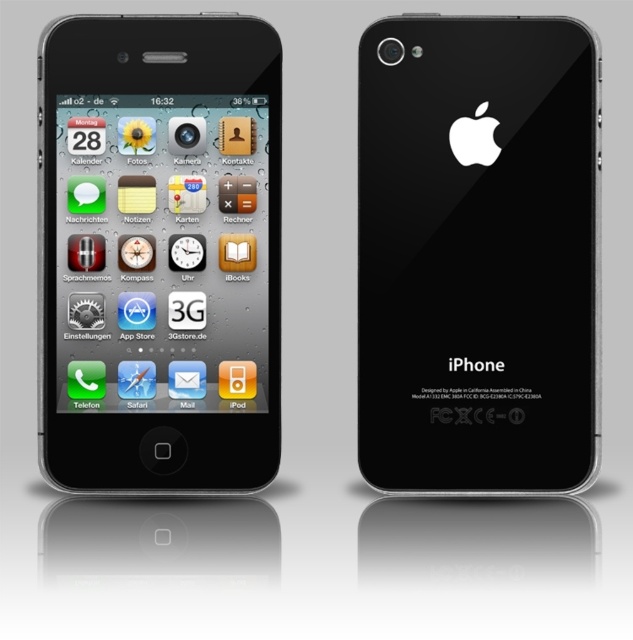
Question: Which point is farther from the camera taking this photo?

Choices:
 (A) (503, 250)
 (B) (70, 28)

Answer: (A)

Question: From the image, what is the correct spatial relationship of black glossy iphone at left in relation to black glossy iphone at center?

Choices:
 (A) above
 (B) below

Answer: (A)

Question: Which point is farther to the camera?

Choices:
 (A) (128, 29)
 (B) (556, 456)

Answer: (A)

Question: Which of the following is the closest to the observer?

Choices:
 (A) (115, 321)
 (B) (480, 291)

Answer: (B)

Question: Can you confirm if black glossy iphone at left is positioned below black glossy iphone at center?

Choices:
 (A) no
 (B) yes

Answer: (A)

Question: Is black glossy iphone at left positioned in front of black glossy iphone at center?

Choices:
 (A) yes
 (B) no

Answer: (B)